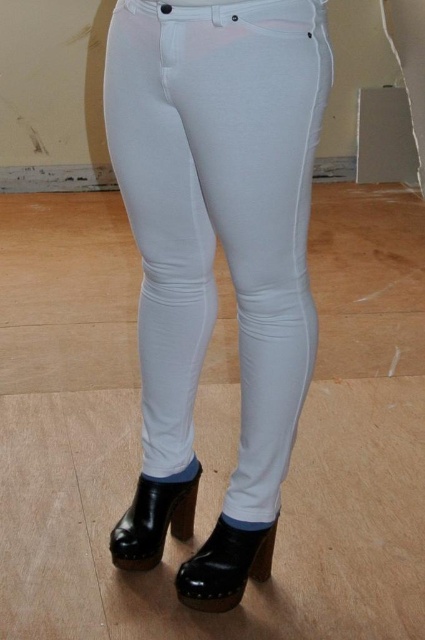
Question: Can you confirm if white smooth pants at center is positioned to the right of glossy patent leather boot at lower center?

Choices:
 (A) no
 (B) yes

Answer: (A)

Question: Is white smooth pants at center above black leather boot at lower center?

Choices:
 (A) no
 (B) yes

Answer: (B)

Question: Which of the following is the farthest from the observer?

Choices:
 (A) black leather boot at lower center
 (B) white smooth pants at center

Answer: (A)

Question: Which of the following is the closest to the observer?

Choices:
 (A) (255, 410)
 (B) (144, 502)

Answer: (A)

Question: Which point is closer to the camera taking this photo?

Choices:
 (A) (200, 470)
 (B) (260, 13)
 (C) (206, 570)

Answer: (B)

Question: Can you confirm if white smooth pants at center is thinner than black leather boot at lower center?

Choices:
 (A) yes
 (B) no

Answer: (B)